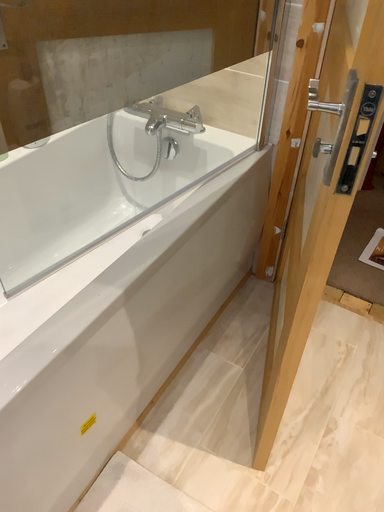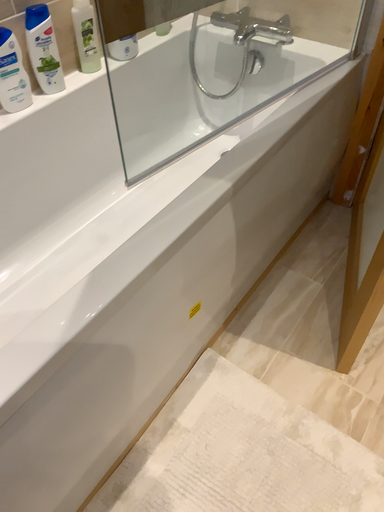
Question: Which way did the camera rotate in the video?

Choices:
 (A) rotated upward
 (B) rotated downward

Answer: (B)